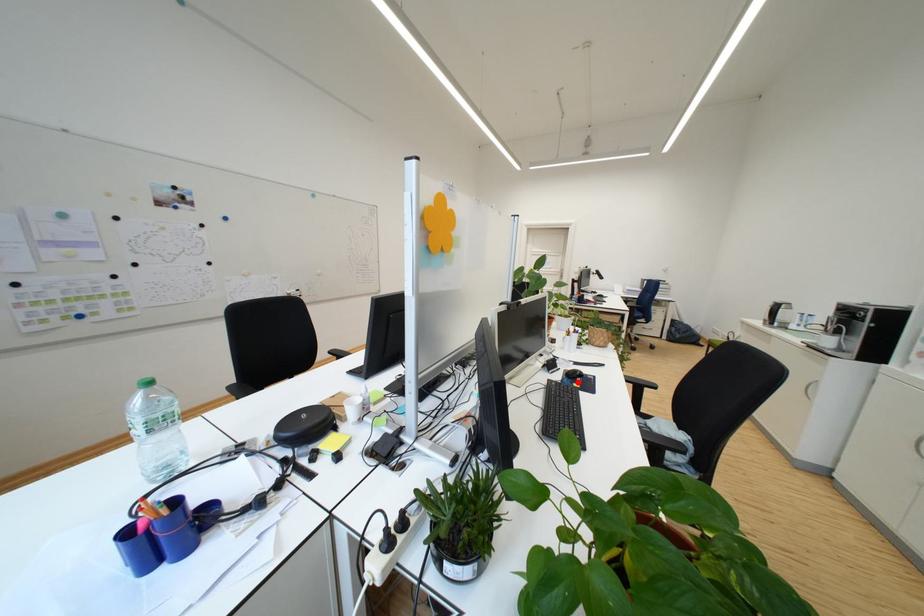
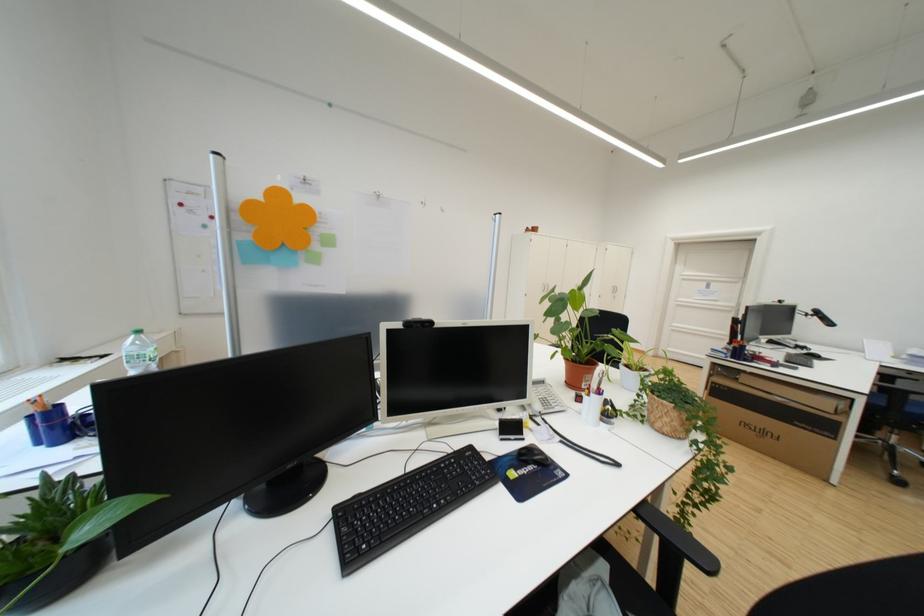
In the second image, find the point that corresponds to the highlighted location in the first image.

(517, 461)